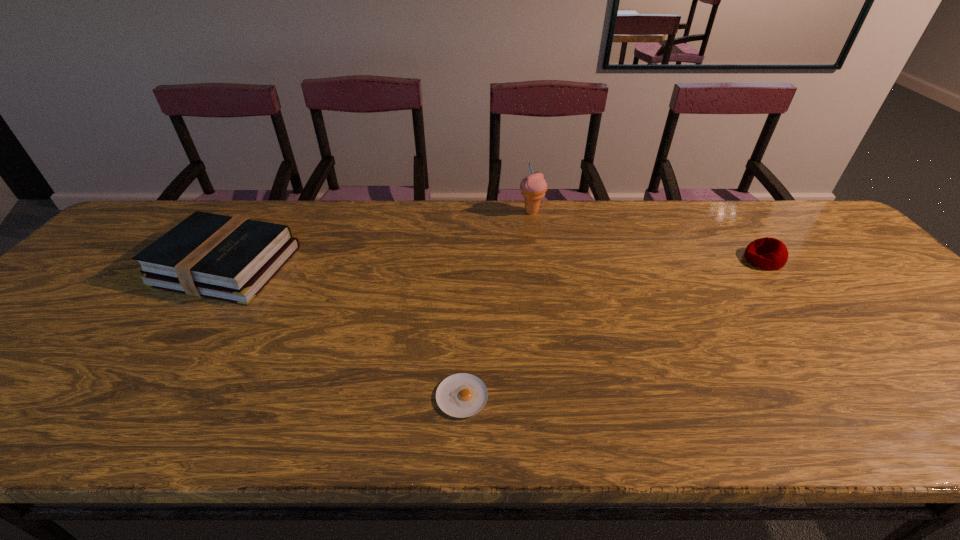
Find the location of `blank space located on the seat area of the rightmost object`. blank space located on the seat area of the rightmost object is located at coordinates (631, 259).

Where is `vacant position located 0.060m on the seat area of the rightmost object`? vacant position located 0.060m on the seat area of the rightmost object is located at coordinates (724, 259).

I want to click on vacant space located on the seat area of the rightmost object, so click(x=620, y=259).

Locate an element on the screen. This screenshot has height=540, width=960. free space located on the back of the egg yolk is located at coordinates (464, 349).

The height and width of the screenshot is (540, 960). Find the location of `icecream that is at the far edge`. icecream that is at the far edge is located at coordinates (533, 187).

Find the location of a particular element. Image resolution: width=960 pixels, height=540 pixels. hardback book at the far edge is located at coordinates (221, 257).

Where is `object located at the near edge`? Image resolution: width=960 pixels, height=540 pixels. object located at the near edge is located at coordinates (461, 395).

The height and width of the screenshot is (540, 960). What are the coordinates of `vacant region at the far edge of the desktop` in the screenshot? It's located at (410, 234).

In order to click on free space at the near edge in this screenshot , I will do `click(26, 435)`.

You are a GUI agent. You are given a task and a screenshot of the screen. Output one action in this format:
    pyautogui.click(x=<x>, y=<y>)
    Task: Click on the vacant space at the left edge of the desktop
    The height and width of the screenshot is (540, 960).
    Given the screenshot: What is the action you would take?
    pyautogui.click(x=124, y=269)